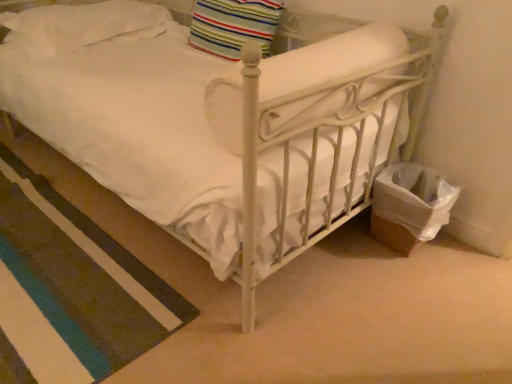
Question: Could you tell me if white soft rug at lower left is facing striped fabric pillow at upper center, the 2th pillow positioned from the left?

Choices:
 (A) yes
 (B) no

Answer: (B)

Question: From a real-world perspective, does white soft rug at lower left sit lower than striped fabric pillow at upper center, the 2th pillow positioned from the left?

Choices:
 (A) no
 (B) yes

Answer: (B)

Question: Is white soft rug at lower left at the right side of striped fabric pillow at upper center, the 2th pillow positioned from the left?

Choices:
 (A) yes
 (B) no

Answer: (B)

Question: Can you confirm if white soft rug at lower left is thinner than striped fabric pillow at upper center, the 2th pillow positioned from the left?

Choices:
 (A) yes
 (B) no

Answer: (B)

Question: Is white soft rug at lower left shorter than striped fabric pillow at upper center, the 2th pillow positioned from the left?

Choices:
 (A) no
 (B) yes

Answer: (B)

Question: Considering the positions of white soft pillow at upper left, marked as the first pillow in a left-to-right arrangement, and striped fabric pillow at upper center, placed as the first pillow when sorted from right to left, in the image, is white soft pillow at upper left, marked as the first pillow in a left-to-right arrangement, wider or thinner than striped fabric pillow at upper center, placed as the first pillow when sorted from right to left,?

Choices:
 (A) wide
 (B) thin

Answer: (A)

Question: Looking at the image, does white soft pillow at upper left, marked as the first pillow in a left-to-right arrangement, seem bigger or smaller compared to striped fabric pillow at upper center, placed as the first pillow when sorted from right to left?

Choices:
 (A) big
 (B) small

Answer: (A)

Question: Is white soft pillow at upper left, marked as the first pillow in a left-to-right arrangement, inside the boundaries of striped fabric pillow at upper center, the 2th pillow positioned from the left, or outside?

Choices:
 (A) outside
 (B) inside

Answer: (A)

Question: From their relative heights in the image, would you say white soft pillow at upper left, which is counted as the second pillow, starting from the right, is taller or shorter than striped fabric pillow at upper center, the 2th pillow positioned from the left?

Choices:
 (A) short
 (B) tall

Answer: (A)

Question: Would you say striped fabric pillow at upper center, placed as the first pillow when sorted from right to left, is to the left or to the right of white soft rug at lower left in the picture?

Choices:
 (A) left
 (B) right

Answer: (B)

Question: Is striped fabric pillow at upper center, placed as the first pillow when sorted from right to left, situated inside white soft rug at lower left or outside?

Choices:
 (A) inside
 (B) outside

Answer: (B)

Question: In the image, is striped fabric pillow at upper center, placed as the first pillow when sorted from right to left, positioned in front of or behind white soft rug at lower left?

Choices:
 (A) front
 (B) behind

Answer: (B)

Question: Considering the positions of striped fabric pillow at upper center, the 2th pillow positioned from the left, and white soft rug at lower left in the image, is striped fabric pillow at upper center, the 2th pillow positioned from the left, bigger or smaller than white soft rug at lower left?

Choices:
 (A) small
 (B) big

Answer: (A)

Question: From a real-world perspective, is white soft rug at lower left positioned above or below white soft pillow at upper left, which is counted as the second pillow, starting from the right?

Choices:
 (A) above
 (B) below

Answer: (B)

Question: In terms of width, does white soft rug at lower left look wider or thinner when compared to white soft pillow at upper left, which is counted as the second pillow, starting from the right?

Choices:
 (A) thin
 (B) wide

Answer: (B)